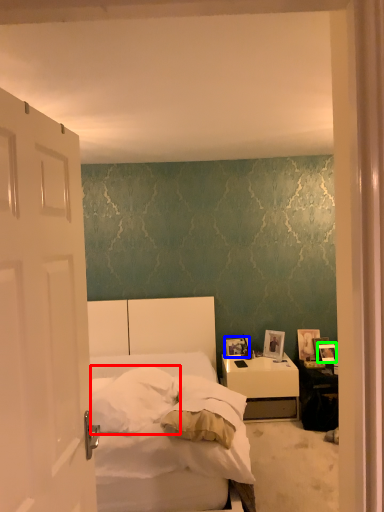
Question: Which object is the farthest from pillow (highlighted by a red box)? Choose among these: picture frame (highlighted by a blue box) or picture frame (highlighted by a green box).

Choices:
 (A) picture frame
 (B) picture frame

Answer: (B)